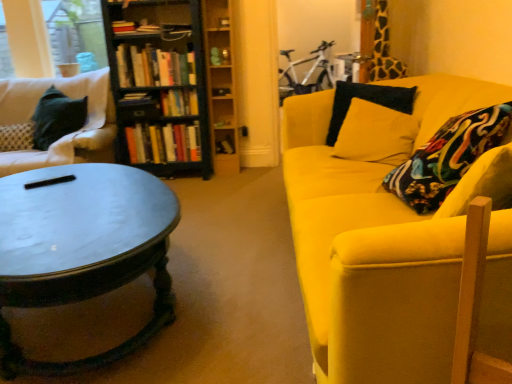
Locate an element on the screen. The image size is (512, 384). free space above matte black coffee table at left (from a real-world perspective) is located at coordinates (97, 203).